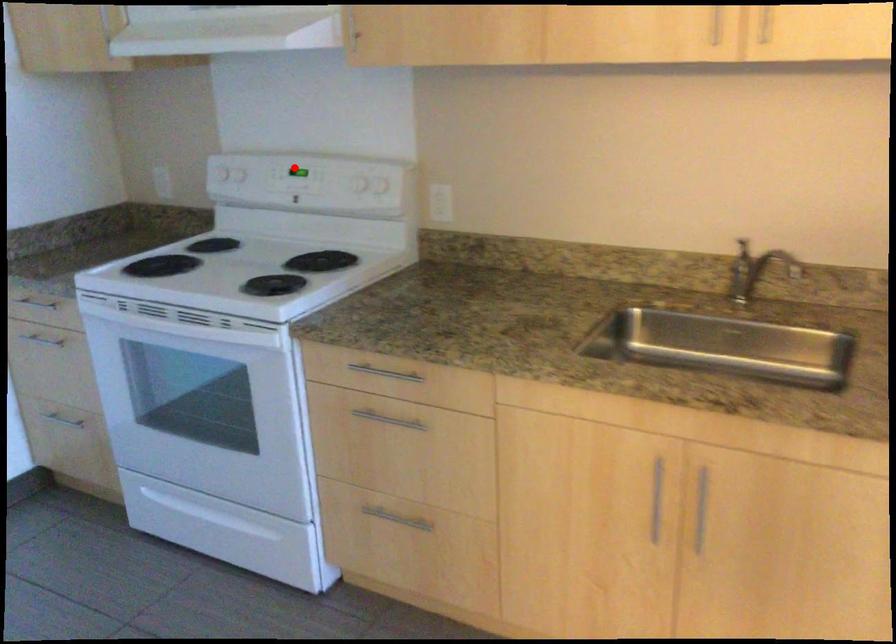
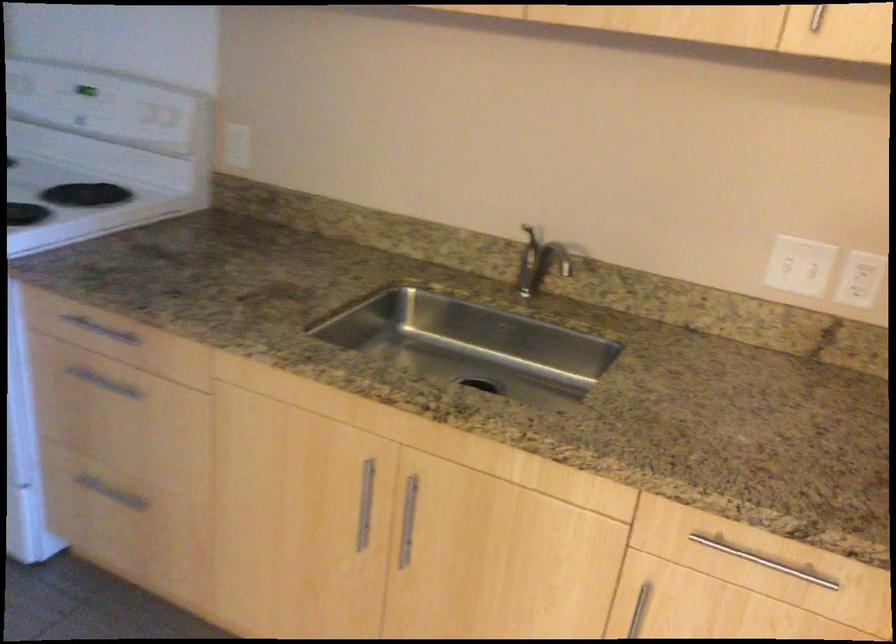
The point at the highlighted location is marked in the first image. Where is the corresponding point in the second image?

(85, 90)